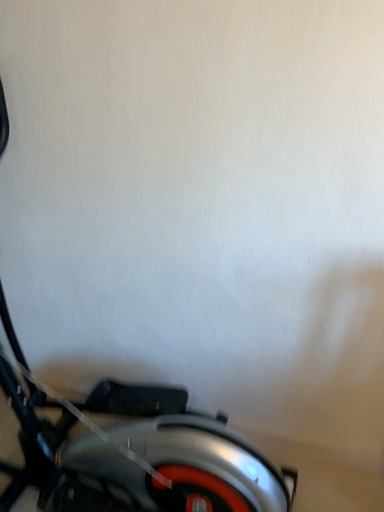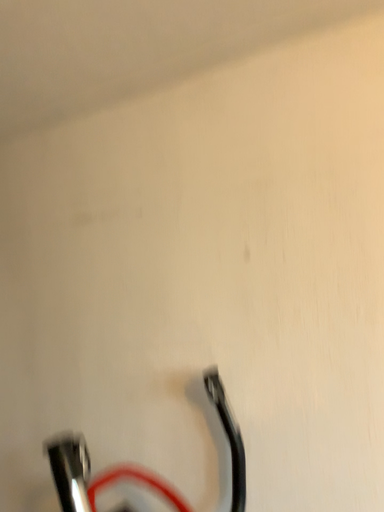
Question: Which way did the camera rotate in the video?

Choices:
 (A) rotated right
 (B) rotated left

Answer: (B)